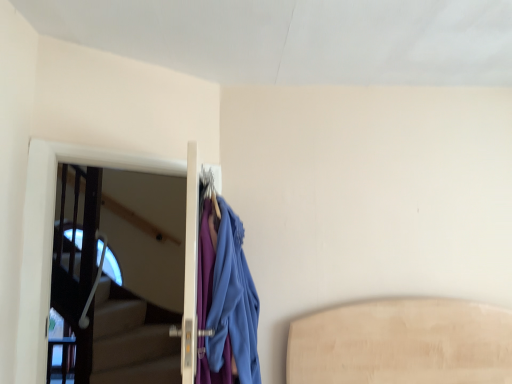
The image size is (512, 384). Identify the location of transparent glass screen door at left. (52, 237).

Measure the distance between transparent glass screen door at left and camera.

The depth of transparent glass screen door at left is 1.64 meters.

What do you see at coordinates (52, 237) in the screenshot? The width and height of the screenshot is (512, 384). I see `transparent glass screen door at left` at bounding box center [52, 237].

Identify the location of blue fabric coat at center. The height and width of the screenshot is (384, 512). (226, 302).

What is the approximate height of blue fabric coat at center?

blue fabric coat at center is 1.11 meters tall.

What do you see at coordinates (226, 302) in the screenshot? I see `blue fabric coat at center` at bounding box center [226, 302].

You are a GUI agent. You are given a task and a screenshot of the screen. Output one action in this format:
    pyautogui.click(x=<x>, y=<y>)
    Task: Click on the transparent glass screen door at left
    This screenshot has width=512, height=384.
    Given the screenshot: What is the action you would take?
    tap(52, 237)

Can you confirm if blue fabric coat at center is positioned to the right of transparent glass screen door at left?

Correct, you'll find blue fabric coat at center to the right of transparent glass screen door at left.

Considering their positions, is blue fabric coat at center located in front of or behind transparent glass screen door at left?

blue fabric coat at center is positioned closer to the viewer than transparent glass screen door at left.

Is point (201, 328) positioned after point (67, 161)?

That is False.

From the image's perspective, is blue fabric coat at center beneath transparent glass screen door at left?

Yes, from the image's perspective, blue fabric coat at center is below transparent glass screen door at left.

From a real-world perspective, which object stands above the other?

transparent glass screen door at left.

Considering the sizes of objects blue fabric coat at center and transparent glass screen door at left in the image provided, who is wider, blue fabric coat at center or transparent glass screen door at left?

blue fabric coat at center is wider.

Considering the relative sizes of blue fabric coat at center and transparent glass screen door at left in the image provided, is blue fabric coat at center taller than transparent glass screen door at left?

Incorrect, the height of blue fabric coat at center is not larger of that of transparent glass screen door at left.

Based on their sizes in the image, would you say blue fabric coat at center is bigger or smaller than transparent glass screen door at left?

Clearly, blue fabric coat at center is larger in size than transparent glass screen door at left.

Is transparent glass screen door at left surrounded by blue fabric coat at center?

No, transparent glass screen door at left is not surrounded by blue fabric coat at center.

Are blue fabric coat at center and transparent glass screen door at left making contact?

No, blue fabric coat at center is not in contact with transparent glass screen door at left.

Is blue fabric coat at center facing towards transparent glass screen door at left?

Yes, blue fabric coat at center is oriented towards transparent glass screen door at left.

How many degrees apart are the facing directions of blue fabric coat at center and transparent glass screen door at left?

52 degrees.

I want to click on screen door on the left of blue fabric coat at center, so click(x=52, y=237).

Is transparent glass screen door at left to the left of blue fabric coat at center from the viewer's perspective?

Yes.

Is transparent glass screen door at left positioned in front of blue fabric coat at center?

No, transparent glass screen door at left is further to the viewer.

Considering the positions of point (30, 145) and point (225, 344), is point (30, 145) closer or farther from the camera than point (225, 344)?

Point (30, 145) appears to be farther away from the viewer than point (225, 344).

From the image's perspective, which one is positioned lower, transparent glass screen door at left or blue fabric coat at center?

blue fabric coat at center is shown below in the image.

In the scene shown: From a real-world perspective, who is located higher, transparent glass screen door at left or blue fabric coat at center?

From a 3D spatial view, transparent glass screen door at left is above.

Can you confirm if transparent glass screen door at left is wider than blue fabric coat at center?

No.

Considering the sizes of objects transparent glass screen door at left and blue fabric coat at center in the image provided, who is shorter, transparent glass screen door at left or blue fabric coat at center?

With less height is blue fabric coat at center.

Who is smaller, transparent glass screen door at left or blue fabric coat at center?

With smaller size is transparent glass screen door at left.

Choose the correct answer: Is transparent glass screen door at left inside blue fabric coat at center or outside it?

transparent glass screen door at left lies outside blue fabric coat at center.

In the scene shown: Would you say transparent glass screen door at left is a long distance from blue fabric coat at center?

transparent glass screen door at left is near blue fabric coat at center, not far away.

Is transparent glass screen door at left oriented towards blue fabric coat at center?

Yes, transparent glass screen door at left faces towards blue fabric coat at center.

I want to click on screen door lying above the blue fabric coat at center (from the image's perspective), so click(x=52, y=237).

You are a GUI agent. You are given a task and a screenshot of the screen. Output one action in this format:
    pyautogui.click(x=<x>, y=<y>)
    Task: Click on the cloak to the right of transparent glass screen door at left
    
    Given the screenshot: What is the action you would take?
    pyautogui.click(x=226, y=302)

This screenshot has height=384, width=512. Find the location of `cloak in front of the transparent glass screen door at left`. cloak in front of the transparent glass screen door at left is located at coordinates (226, 302).